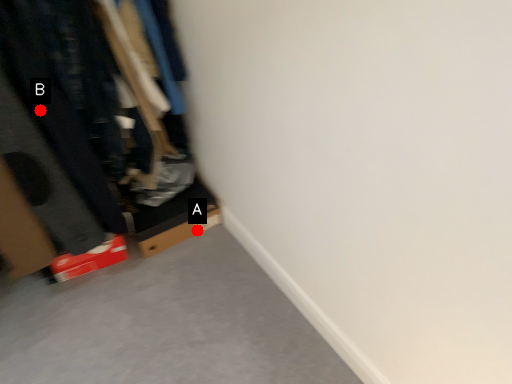
Question: Two points are circled on the image, labeled by A and B beside each circle. Which point is farther from the camera taking this photo?

Choices:
 (A) A is further
 (B) B is further

Answer: (A)